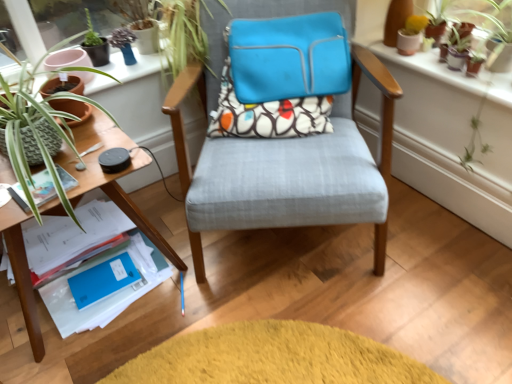
Measure the distance between matte paper at left, placed as the second paperback book when sorted from bottom to top, and camera.

matte paper at left, placed as the second paperback book when sorted from bottom to top, and camera are 1.07 meters apart.

You are a GUI agent. You are given a task and a screenshot of the screen. Output one action in this format:
    pyautogui.click(x=<x>, y=<y>)
    Task: Click on the matte paper at left, arranged as the 1th paperback book when viewed from the top
    The width and height of the screenshot is (512, 384).
    Given the screenshot: What is the action you would take?
    pyautogui.click(x=42, y=188)

In order to click on matte terracotta pot at left in this screenshot , I will do `click(72, 110)`.

What is the approximate height of wooden table at left?

wooden table at left is 18.81 inches in height.

What do you see at coordinates (254, 18) in the screenshot? This screenshot has height=384, width=512. I see `matte blue laptop case at center, which appears as the 1th chair when viewed from the back` at bounding box center [254, 18].

This screenshot has width=512, height=384. Identify the location of matte blue laptop case at center, which appears as the 2th chair when viewed from the front. (254, 18).

Where is `matte paper at left, placed as the second paperback book when sorted from bottom to top`? The width and height of the screenshot is (512, 384). matte paper at left, placed as the second paperback book when sorted from bottom to top is located at coordinates (42, 188).

Measure the distance from wooden table at left to patterned fabric pillow at center.

wooden table at left is 18.21 inches from patterned fabric pillow at center.

Is wooden table at left next to patterned fabric pillow at center?

wooden table at left is not next to patterned fabric pillow at center, and they're not touching.

From the image's perspective, relative to patterned fabric pillow at center, is wooden table at left above or below?

Based on their image positions, wooden table at left is located beneath patterned fabric pillow at center.

From the picture: From a real-world perspective, is matte blue laptop case at center, which appears as the 2th chair when viewed from the front, positioned under wooden table at left based on gravity?

Incorrect, from a real-world perspective, matte blue laptop case at center, which appears as the 2th chair when viewed from the front, is higher than wooden table at left.

From the image's perspective, is matte blue laptop case at center, which appears as the 1th chair when viewed from the back, above or below wooden table at left?

From the image's perspective, matte blue laptop case at center, which appears as the 1th chair when viewed from the back, appears above wooden table at left.

From the image's perspective, starting from the wooden table at left, which chair is the 2nd one above? Please provide its 2D coordinates.

[(254, 18)]

Based on the photo, is matte blue laptop case at center, which appears as the 2th chair when viewed from the front, behind wooden table at left?

Yes, the depth of matte blue laptop case at center, which appears as the 2th chair when viewed from the front, is greater than that of wooden table at left.

Looking at the image, does matte blue laptop case at center, which appears as the 1th chair when viewed from the back, seem bigger or smaller compared to matte paper at left, which is the second paperback book from back to front?

In the image, matte blue laptop case at center, which appears as the 1th chair when viewed from the back, appears to be larger than matte paper at left, which is the second paperback book from back to front.

Considering the points (302, 11) and (44, 186), which point is behind, point (302, 11) or point (44, 186)?

The point (302, 11) is more distant.

Where is `chair above the matte paper at left, the 1th paperback book positioned from the front (from a real-world perspective)`? Image resolution: width=512 pixels, height=384 pixels. chair above the matte paper at left, the 1th paperback book positioned from the front (from a real-world perspective) is located at coordinates (254, 18).

From a real-world perspective, who is located lower, terracotta clay pots at upper right or wooden table at left?

wooden table at left.

From the image's perspective, between terracotta clay pots at upper right and wooden table at left, which one is located above?

terracotta clay pots at upper right, from the image's perspective.

Between point (357, 40) and point (88, 167), which one is positioned behind?

The point (357, 40) is behind.

Is terracotta clay pots at upper right to the left of wooden table at left from the viewer's perspective?

No.

Is matte paper at left, which is the second paperback book from back to front, not near blue matte paper at lower left, the second paperback book viewed from the front?

That's not correct — matte paper at left, which is the second paperback book from back to front, is a little close to blue matte paper at lower left, the second paperback book viewed from the front.

Is matte paper at left, the 1th paperback book positioned from the front, to the right of blue matte paper at lower left, marked as the second paperback book in a top-to-bottom arrangement, from the viewer's perspective?

In fact, matte paper at left, the 1th paperback book positioned from the front, is to the left of blue matte paper at lower left, marked as the second paperback book in a top-to-bottom arrangement.

In the image, is matte paper at left, which is the second paperback book from back to front, positioned in front of or behind blue matte paper at lower left, the second paperback book viewed from the front?

Clearly, matte paper at left, which is the second paperback book from back to front, is in front of blue matte paper at lower left, the second paperback book viewed from the front.

How far apart are matte paper at left, which is the second paperback book from back to front, and blue matte paper at lower left, the first paperback book from the back?

The distance of matte paper at left, which is the second paperback book from back to front, from blue matte paper at lower left, the first paperback book from the back, is 17.32 inches.

Which is behind, patterned fabric pillow at center or matte blue laptop case at center, which appears as the 2th chair when viewed from the front?

patterned fabric pillow at center is further away from the camera.

In the scene shown: Is patterned fabric pillow at center not close to matte blue laptop case at center, which appears as the 1th chair when viewed from the back?

patterned fabric pillow at center is actually quite close to matte blue laptop case at center, which appears as the 1th chair when viewed from the back.

Can you confirm if patterned fabric pillow at center is shorter than matte blue laptop case at center, which appears as the 1th chair when viewed from the back?

Yes.

Based on the photo, from the image's perspective, does patterned fabric pillow at center appear lower than matte blue laptop case at center, which appears as the 2th chair when viewed from the front?

Yes, from the image's perspective, patterned fabric pillow at center is beneath matte blue laptop case at center, which appears as the 2th chair when viewed from the front.

Is patterned fabric pillow at center positioned far away from textured fabric chair at center, marked as the 1th chair in a front-to-back arrangement?

No, patterned fabric pillow at center is in close proximity to textured fabric chair at center, marked as the 1th chair in a front-to-back arrangement.

Is point (283, 136) more distant than point (354, 86)?

That is False.

Would you say patterned fabric pillow at center is outside textured fabric chair at center, marked as the 1th chair in a front-to-back arrangement?

Actually, patterned fabric pillow at center is within textured fabric chair at center, marked as the 1th chair in a front-to-back arrangement.

Looking at this image, from their relative heights in the image, would you say patterned fabric pillow at center is taller or shorter than textured fabric chair at center, marked as the second chair in a back-to-front arrangement?

Considering their sizes, patterned fabric pillow at center has less height than textured fabric chair at center, marked as the second chair in a back-to-front arrangement.

Find the location of a particular element. throw pillow on the right of the wooden table at left is located at coordinates (268, 115).

I want to click on table below the matte blue laptop case at center, which appears as the 1th chair when viewed from the back (from the image's perspective), so click(111, 175).

When comparing their distances from blue matte paper at lower left, the second paperback book viewed from the front, does matte terracotta pot at left or terracotta clay pots at upper right seem closer?

matte terracotta pot at left lies closer to blue matte paper at lower left, the second paperback book viewed from the front, than the other object.

Based on their spatial positions, is matte paper at left, arranged as the 1th paperback book when viewed from the top, or matte blue laptop case at center, which appears as the 1th chair when viewed from the back, further from wooden table at left?

matte blue laptop case at center, which appears as the 1th chair when viewed from the back, lies further to wooden table at left than the other object.

When comparing their distances from patterned fabric pillow at center, does textured fabric chair at center, marked as the 1th chair in a front-to-back arrangement, or terracotta clay pots at upper right seem further?

Based on the image, terracotta clay pots at upper right appears to be further to patterned fabric pillow at center.

Estimate the real-world distances between objects in this image. Which object is closer to matte paper at left, which is the second paperback book from back to front, terracotta clay pots at upper right or matte blue laptop case at center, which appears as the 1th chair when viewed from the back?

matte blue laptop case at center, which appears as the 1th chair when viewed from the back.

Which object lies further to the anchor point matte terracotta pot at left, wooden table at left or patterned fabric pillow at center?

patterned fabric pillow at center is positioned further to the anchor matte terracotta pot at left.

From the image, which object appears to be farther from patterned fabric pillow at center, textured fabric chair at center, marked as the second chair in a back-to-front arrangement, or matte paper at left, placed as the second paperback book when sorted from bottom to top?

matte paper at left, placed as the second paperback book when sorted from bottom to top.

Estimate the real-world distances between objects in this image. Which object is further from terracotta clay pots at upper right, matte blue laptop case at center, which appears as the 2th chair when viewed from the front, or wooden table at left?

Among the two, wooden table at left is located further to terracotta clay pots at upper right.

From the image, which object appears to be nearer to textured fabric chair at center, marked as the 1th chair in a front-to-back arrangement, blue matte paper at lower left, marked as the second paperback book in a top-to-bottom arrangement, or patterned fabric pillow at center?

Based on the image, patterned fabric pillow at center appears to be nearer to textured fabric chair at center, marked as the 1th chair in a front-to-back arrangement.

Identify the location of throw pillow between matte terracotta pot at left and terracotta clay pots at upper right. (268, 115).

The height and width of the screenshot is (384, 512). What are the coordinates of `flowerpot between wooden table at left and terracotta clay pots at upper right in the horizontal direction` in the screenshot? It's located at (72, 110).

Locate an element on the screen. The height and width of the screenshot is (384, 512). chair located between textured fabric chair at center, marked as the 1th chair in a front-to-back arrangement, and terracotta clay pots at upper right in the left-right direction is located at coordinates (254, 18).

At what (x,y) coordinates should I click in order to perform the action: click on paperback book between matte terracotta pot at left and wooden table at left in the vertical direction. Please return your answer as a coordinate pair (x, y). Looking at the image, I should click on (42, 188).